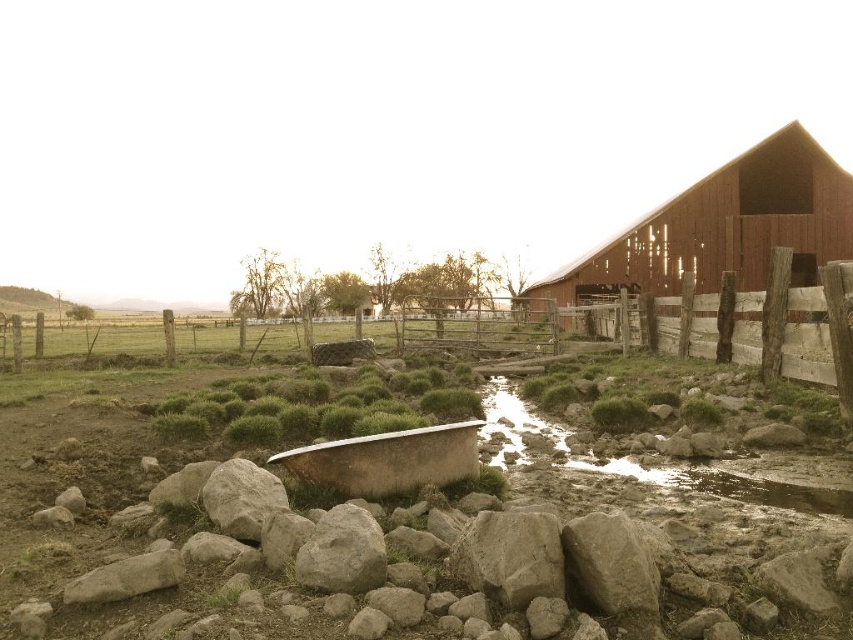
You are a farmer checking the water supply. You see the wooden fence at right and the rusty metal tub at center. Which object is located to the right of the other?

The wooden fence at right is positioned on the right side of the rusty metal tub at center, so the wooden fence at right is to the right of the rusty metal tub at center.